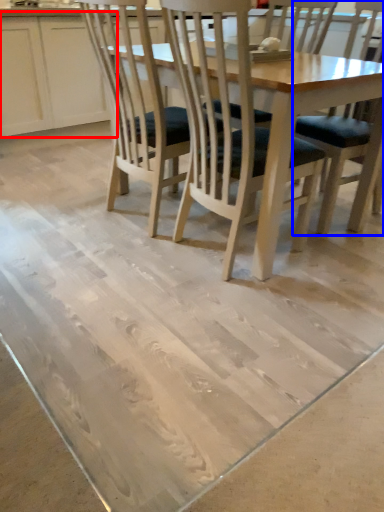
Question: Which object appears farthest to the camera in this image, cabinetry (highlighted by a red box) or chair (highlighted by a blue box)?

Choices:
 (A) cabinetry
 (B) chair

Answer: (A)